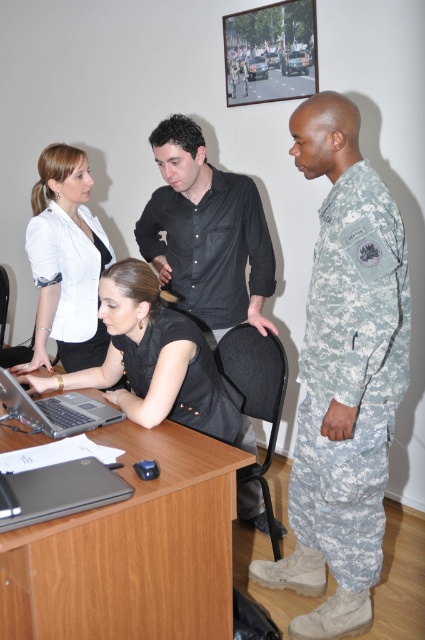
Question: Among these points, which one is farthest from the camera?

Choices:
 (A) (82, 385)
 (B) (227, 317)

Answer: (B)

Question: Where is camouflage fabric uniform at right located in relation to black matte laptop at lower left in the image?

Choices:
 (A) left
 (B) right

Answer: (B)

Question: Can you confirm if black smooth shirt at center is smaller than camouflage fabric uniform at center?

Choices:
 (A) no
 (B) yes

Answer: (A)

Question: Can you confirm if black matte shirt at center is smaller than white matte blazer at upper left?

Choices:
 (A) yes
 (B) no

Answer: (B)

Question: Which of the following is the closest to the observer?

Choices:
 (A) (104, 488)
 (B) (377, 422)

Answer: (A)

Question: Which of the following is the farthest from the observer?

Choices:
 (A) black matte laptop at lower left
 (B) camouflage fabric uniform at center

Answer: (B)